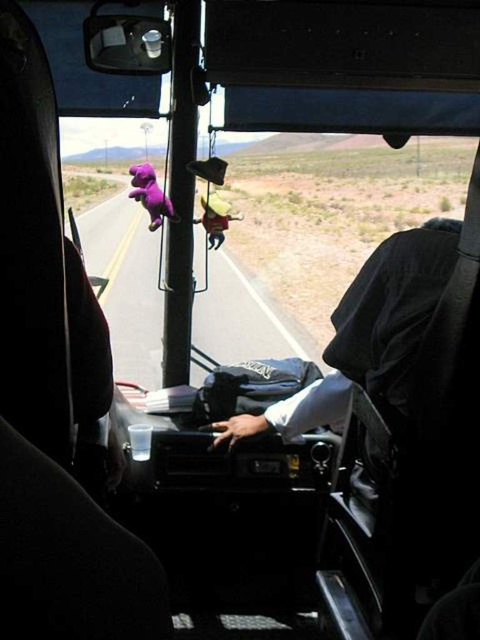
Question: Is purple matte dinosaur at center positioned before yellow fabric stuffed animal at center?

Choices:
 (A) yes
 (B) no

Answer: (A)

Question: Which point appears farthest from the camera in this image?

Choices:
 (A) tap(148, 180)
 (B) tap(225, 218)

Answer: (B)

Question: Considering the relative positions of purple matte dinosaur at center and yellow fabric stuffed animal at center in the image provided, where is purple matte dinosaur at center located with respect to yellow fabric stuffed animal at center?

Choices:
 (A) below
 (B) above

Answer: (B)

Question: Is purple matte dinosaur at center bigger than yellow fabric stuffed animal at center?

Choices:
 (A) no
 (B) yes

Answer: (B)